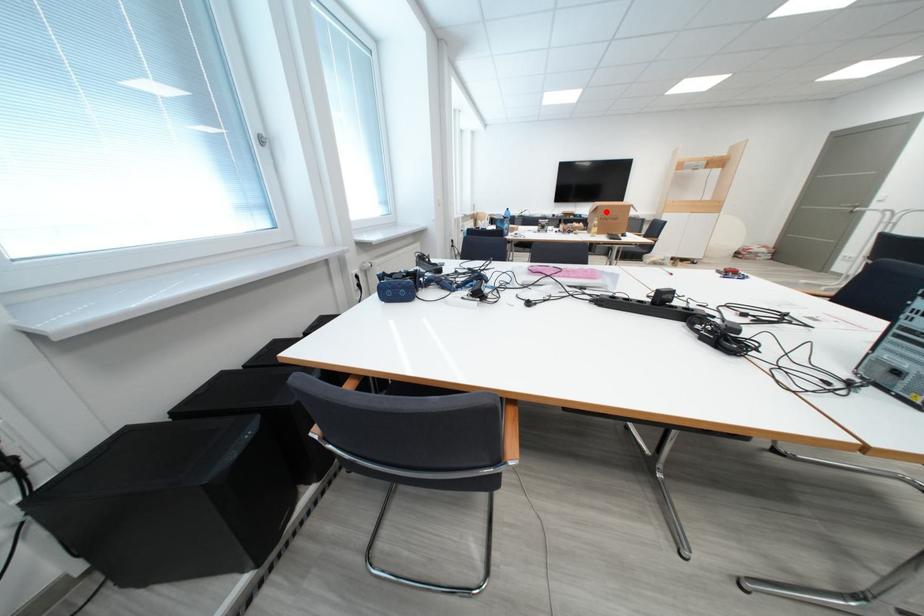
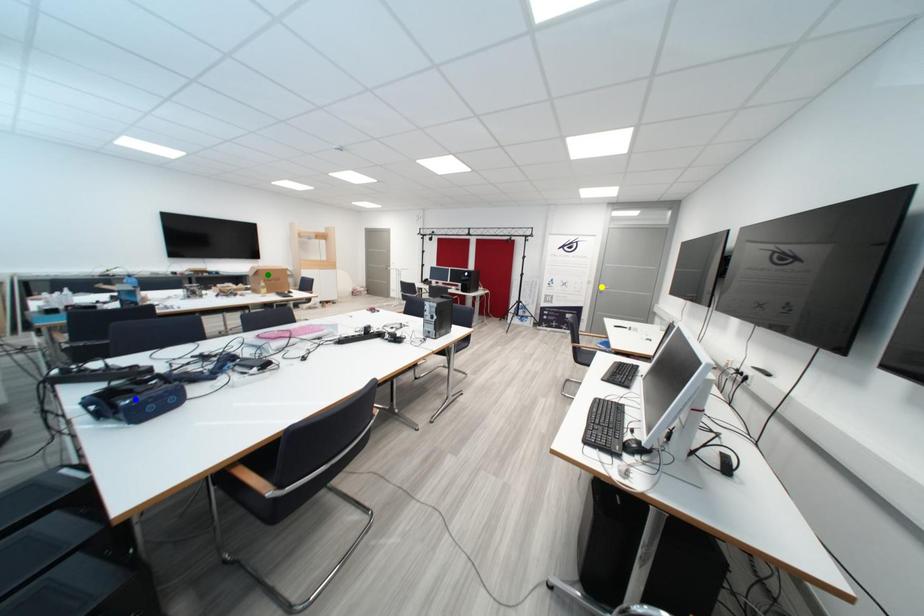
Question: I am providing you with two images of the same scene from different viewpoints. A red point is marked on the first image. You are given multiple points on the second image. In image 2, which mark is for the same physical point as the one in image 1?

Choices:
 (A) yellow point
 (B) green point
 (C) blue point

Answer: (B)